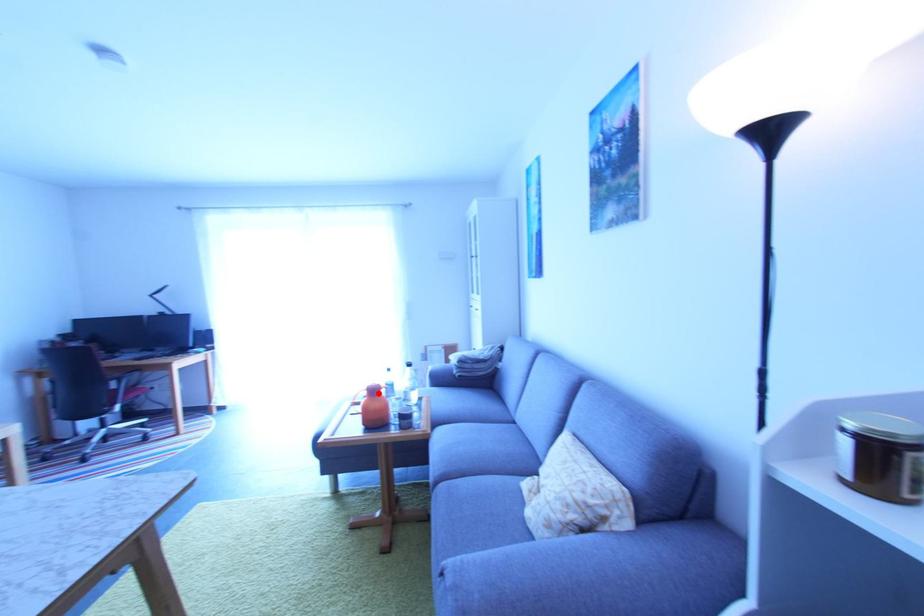
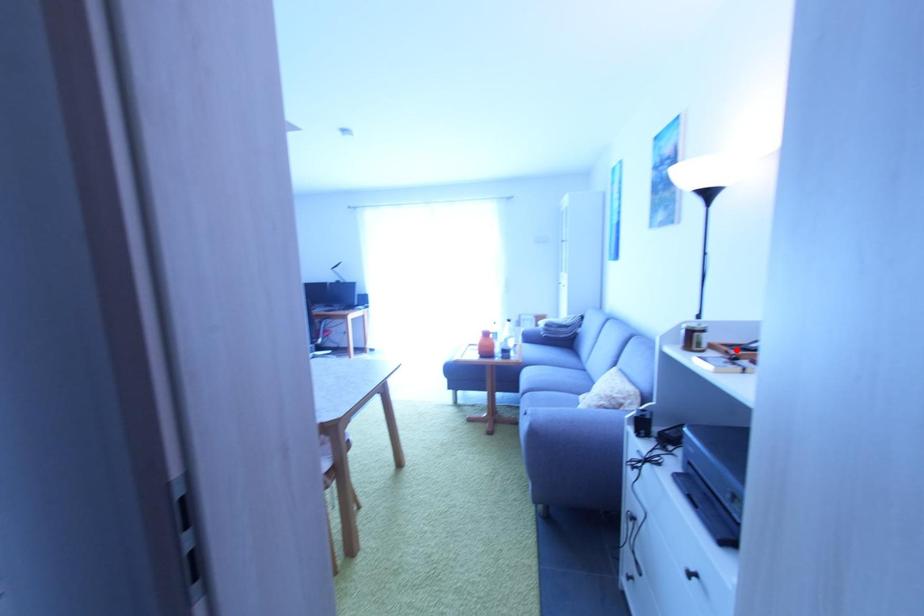
I am providing you with two images of the same scene from different viewpoints. A red point is marked on the first image and another point is marked on the second image. Is the red point in image1 aligned with the point shown in image2?

No